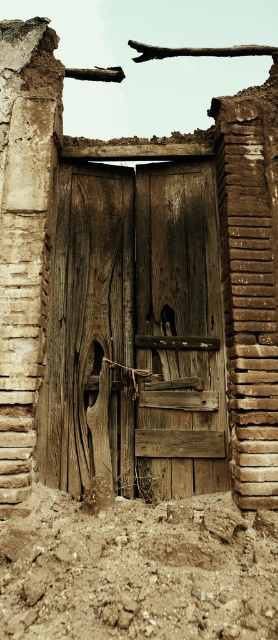
How much distance is there between weathered wood door at center and brown sandy soil at lower center?

They are 31.87 inches apart.

Can you confirm if weathered wood door at center is wider than brown sandy soil at lower center?

No, weathered wood door at center is not wider than brown sandy soil at lower center.

Identify the location of weathered wood door at center. (137, 330).

Locate an element on the screen. weathered wood door at center is located at coordinates (137, 330).